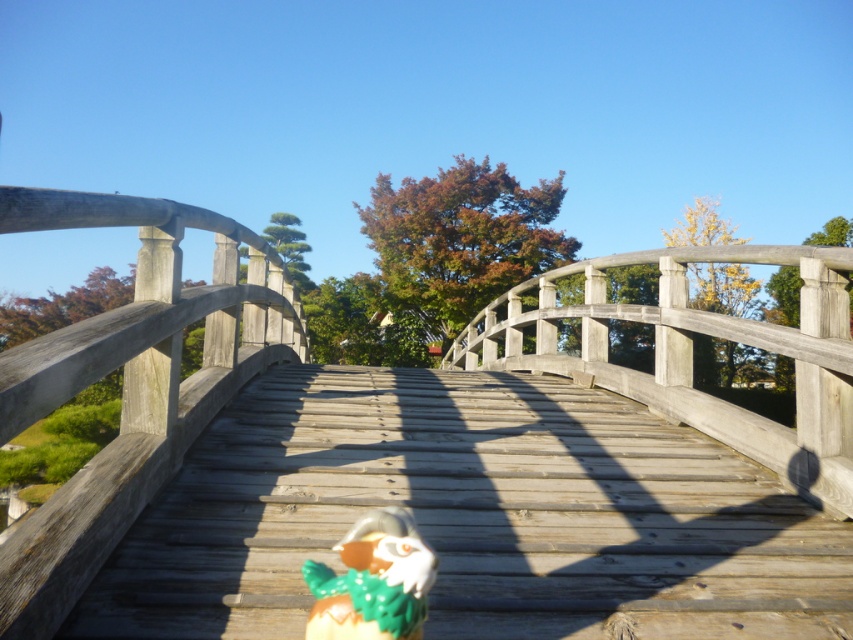
Question: Does wooden bridge at center appear on the left side of shiny metallic toy at center?

Choices:
 (A) yes
 (B) no

Answer: (B)

Question: Is wooden bridge at center positioned behind shiny metallic toy at center?

Choices:
 (A) yes
 (B) no

Answer: (A)

Question: Which of the following is the farthest from the observer?

Choices:
 (A) wooden bridge at center
 (B) shiny metallic toy at center

Answer: (A)

Question: Which point is farther to the camera?

Choices:
 (A) (317, 634)
 (B) (227, 381)

Answer: (B)

Question: Does wooden bridge at center appear under shiny metallic toy at center?

Choices:
 (A) yes
 (B) no

Answer: (A)